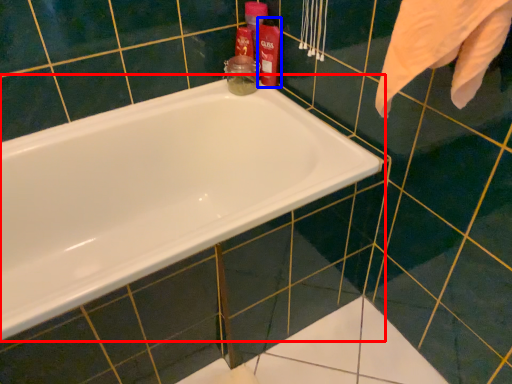
Question: Which point is further to the camera, bathtub (highlighted by a red box) or cleaning product (highlighted by a blue box)?

Choices:
 (A) bathtub
 (B) cleaning product

Answer: (B)